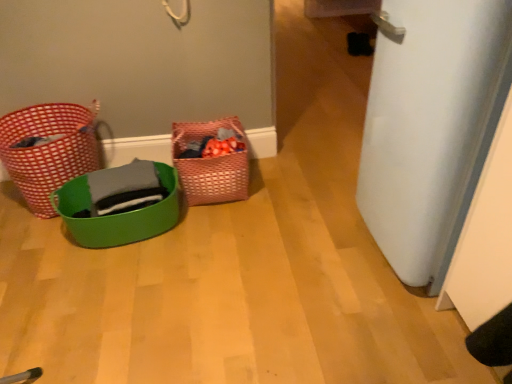
Question: Is green plastic basket at lower left, marked as the second basket in a right-to-left arrangement, further to camera compared to woven pink basket at center, arranged as the 1th basket when viewed from the right?

Choices:
 (A) no
 (B) yes

Answer: (A)

Question: Can you confirm if green plastic basket at lower left, the second basket when ordered from left to right, is bigger than woven pink basket at center, arranged as the 1th basket when viewed from the right?

Choices:
 (A) yes
 (B) no

Answer: (A)

Question: Considering the relative sizes of green plastic basket at lower left, marked as the second basket in a right-to-left arrangement, and woven pink basket at center, arranged as the 1th basket when viewed from the right, in the image provided, is green plastic basket at lower left, marked as the second basket in a right-to-left arrangement, shorter than woven pink basket at center, arranged as the 1th basket when viewed from the right,?

Choices:
 (A) yes
 (B) no

Answer: (A)

Question: Is green plastic basket at lower left, the second basket when ordered from left to right, at the left side of woven pink basket at center, marked as the third basket in a left-to-right arrangement?

Choices:
 (A) no
 (B) yes

Answer: (B)

Question: From the image's perspective, is green plastic basket at lower left, the second basket when ordered from left to right, on top of woven pink basket at center, marked as the third basket in a left-to-right arrangement?

Choices:
 (A) yes
 (B) no

Answer: (B)

Question: Is green plastic basket at lower left, marked as the second basket in a right-to-left arrangement, at the right side of woven pink basket at center, marked as the third basket in a left-to-right arrangement?

Choices:
 (A) no
 (B) yes

Answer: (A)

Question: Is white matte door at right completely or partially outside of green plastic basket at lower left, marked as the second basket in a right-to-left arrangement?

Choices:
 (A) yes
 (B) no

Answer: (A)

Question: From the image's perspective, is white matte door at right located above green plastic basket at lower left, marked as the second basket in a right-to-left arrangement?

Choices:
 (A) yes
 (B) no

Answer: (A)

Question: Is white matte door at right shorter than green plastic basket at lower left, the second basket when ordered from left to right?

Choices:
 (A) no
 (B) yes

Answer: (A)

Question: Is white matte door at right aimed at green plastic basket at lower left, marked as the second basket in a right-to-left arrangement?

Choices:
 (A) no
 (B) yes

Answer: (B)

Question: Are white matte door at right and green plastic basket at lower left, marked as the second basket in a right-to-left arrangement, making contact?

Choices:
 (A) yes
 (B) no

Answer: (B)

Question: Is green plastic basket at lower left, marked as the second basket in a right-to-left arrangement, inside white matte door at right?

Choices:
 (A) no
 (B) yes

Answer: (A)

Question: Does red woven basket at left, the 1th basket in the left-to-right sequence, lie in front of woven pink basket at center, arranged as the 1th basket when viewed from the right?

Choices:
 (A) no
 (B) yes

Answer: (B)